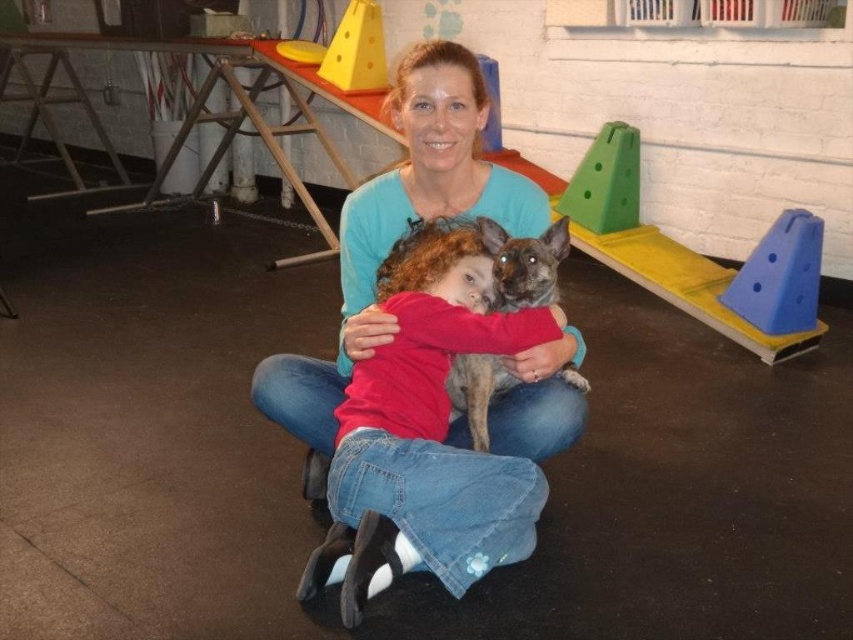
Does matte blue shirt at center appear over speckled fur dog at center?

Yes.

From the picture: Is matte blue shirt at center to the left of speckled fur dog at center from the viewer's perspective?

Yes, matte blue shirt at center is to the left of speckled fur dog at center.

Between point (312, 403) and point (486, 225), which one is positioned behind?

Positioned behind is point (312, 403).

Locate an element on the screen. matte blue shirt at center is located at coordinates (398, 230).